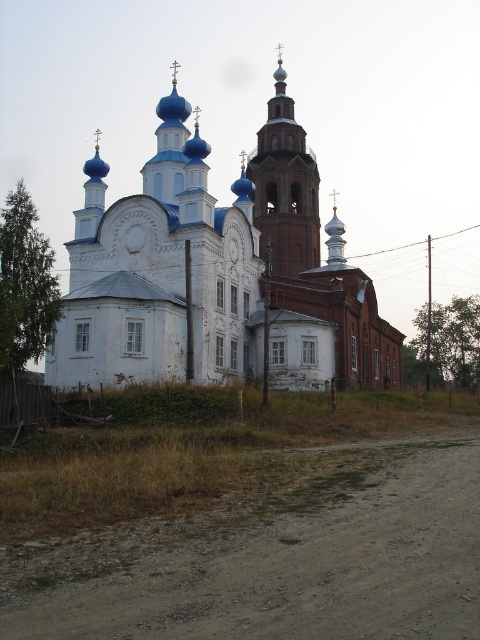
Question: Considering the real-world distances, which object is farthest from the dusty gravel road at lower center?

Choices:
 (A) white wooden church at center
 (B) smooth brown tower at center

Answer: (B)

Question: Among these points, which one is farthest from the camera?

Choices:
 (A) (253, 634)
 (B) (288, 156)
 (C) (57, 380)

Answer: (B)

Question: Does white wooden church at center have a larger size compared to smooth brown tower at center?

Choices:
 (A) yes
 (B) no

Answer: (A)

Question: Does white wooden church at center have a greater width compared to smooth brown tower at center?

Choices:
 (A) yes
 (B) no

Answer: (A)

Question: From the image, what is the correct spatial relationship of dusty gravel road at lower center in relation to smooth brown tower at center?

Choices:
 (A) right
 (B) left

Answer: (B)

Question: Estimate the real-world distances between objects in this image. Which object is closer to the white wooden church at center?

Choices:
 (A) dusty gravel road at lower center
 (B) smooth brown tower at center

Answer: (B)